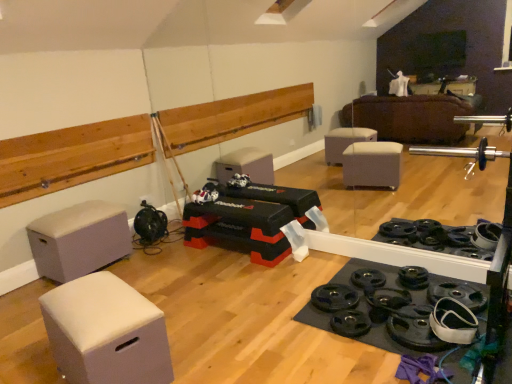
Question: Choose the correct answer: Is white fabric ottoman at lower left, positioned as the 1th furniture in right-to-left order, inside gray fabric ottoman at left, which is the 2th furniture in front-to-back order, or outside it?

Choices:
 (A) inside
 (B) outside

Answer: (B)

Question: Does point (112, 276) appear closer or farther from the camera than point (77, 208)?

Choices:
 (A) closer
 (B) farther

Answer: (A)

Question: Which object is the farthest from the gray fabric ottoman at left, the 1th furniture in the back-to-front sequence?

Choices:
 (A) matte plastic toy at center
 (B) white fabric ottoman at lower left, acting as the second furniture starting from the back

Answer: (B)

Question: Which is nearer to the white fabric ottoman at lower left, the 1th furniture in the front-to-back sequence?

Choices:
 (A) gray fabric ottoman at left, which is the 2th furniture in front-to-back order
 (B) matte plastic toy at center

Answer: (A)